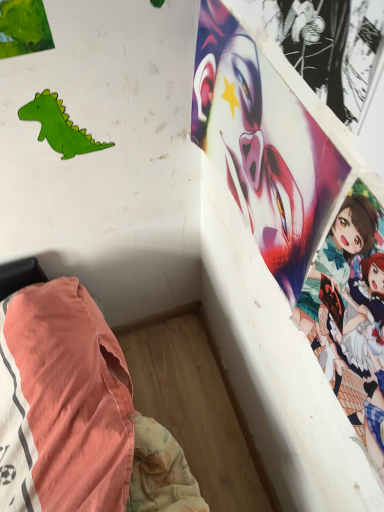
Question: From a real-world perspective, is smooth glossy poster at upper right on top of green matte paper dinosaur at upper left?

Choices:
 (A) yes
 (B) no

Answer: (A)

Question: From the image's perspective, is smooth glossy poster at upper right located above green matte paper dinosaur at upper left?

Choices:
 (A) no
 (B) yes

Answer: (A)

Question: Can you confirm if smooth glossy poster at upper right is thinner than green matte paper dinosaur at upper left?

Choices:
 (A) no
 (B) yes

Answer: (A)

Question: From the image's perspective, is smooth glossy poster at upper right located beneath green matte paper dinosaur at upper left?

Choices:
 (A) no
 (B) yes

Answer: (B)

Question: Is smooth glossy poster at upper right facing towards green matte paper dinosaur at upper left?

Choices:
 (A) yes
 (B) no

Answer: (A)

Question: Is smooth glossy poster at upper right not inside green matte paper dinosaur at upper left?

Choices:
 (A) yes
 (B) no

Answer: (A)

Question: From a real-world perspective, is green matte paper dinosaur at upper left below smooth glossy poster at upper right?

Choices:
 (A) yes
 (B) no

Answer: (A)

Question: Is smooth glossy poster at upper right at the back of green matte paper dinosaur at upper left?

Choices:
 (A) no
 (B) yes

Answer: (A)

Question: Is green matte paper dinosaur at upper left smaller than smooth glossy poster at upper right?

Choices:
 (A) yes
 (B) no

Answer: (A)

Question: Is the surface of green matte paper dinosaur at upper left in direct contact with smooth glossy poster at upper right?

Choices:
 (A) no
 (B) yes

Answer: (A)

Question: From the image's perspective, does green matte paper dinosaur at upper left appear higher than smooth glossy poster at upper right?

Choices:
 (A) yes
 (B) no

Answer: (A)

Question: Considering the relative sizes of green matte paper dinosaur at upper left and smooth glossy poster at upper right in the image provided, is green matte paper dinosaur at upper left bigger than smooth glossy poster at upper right?

Choices:
 (A) yes
 (B) no

Answer: (B)

Question: From the image's perspective, is smooth glossy poster at upper right located above or below green matte paper dinosaur at upper left?

Choices:
 (A) above
 (B) below

Answer: (B)